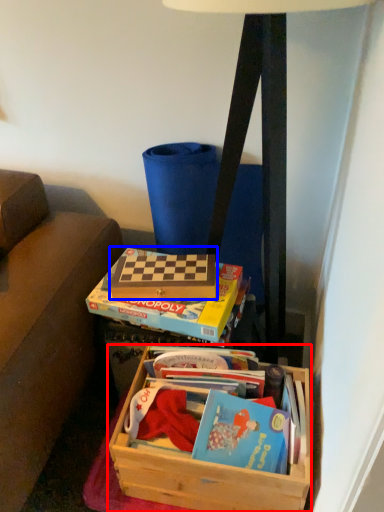
Question: Which point is further to the camera, box (highlighted by a red box) or paperback book (highlighted by a blue box)?

Choices:
 (A) box
 (B) paperback book

Answer: (B)